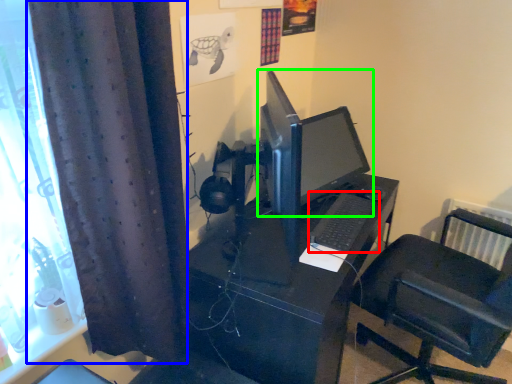
Question: Based on their relative distances, which object is nearer to computer keyboard (highlighted by a red box)? Choose from curtain (highlighted by a blue box) and computer monitor (highlighted by a green box).

Choices:
 (A) curtain
 (B) computer monitor

Answer: (B)